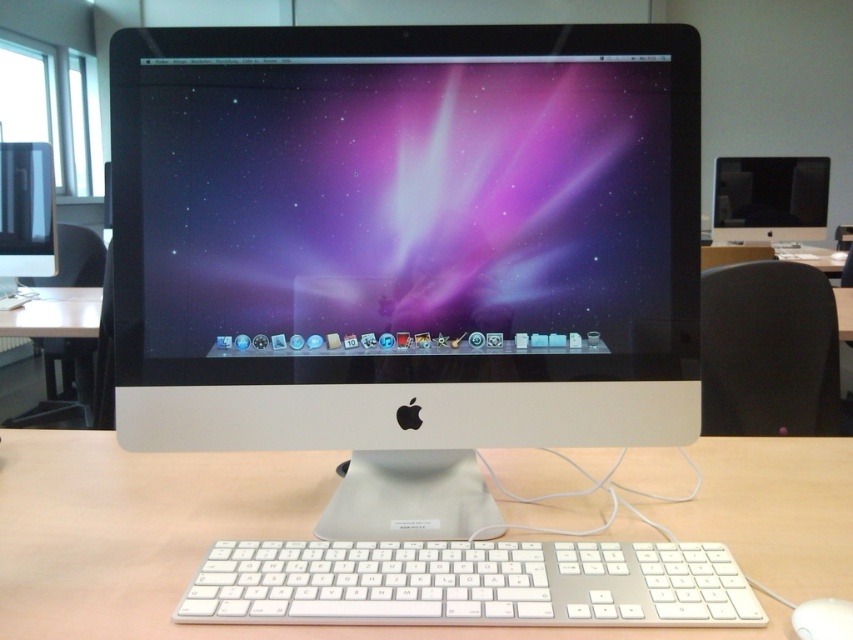
Question: Does white matte computer desk at center have a smaller size compared to white wooden table at lower left?

Choices:
 (A) yes
 (B) no

Answer: (A)

Question: Is black plastic chair at right wider than satin black monitor at upper right?

Choices:
 (A) no
 (B) yes

Answer: (A)

Question: Can you confirm if satin silver monitor at center is wider than matte black monitor at left?

Choices:
 (A) yes
 (B) no

Answer: (A)

Question: Which is nearer to the white matte computer desk at center?

Choices:
 (A) white plastic keyboard at center
 (B) white plastic mouse at lower right
 (C) black plastic chair at right
 (D) matte black monitor at left

Answer: (A)

Question: Among these points, which one is nearest to the camera?

Choices:
 (A) (119, 214)
 (B) (96, 474)
 (C) (811, 310)
 (D) (811, 237)

Answer: (A)

Question: Which of the following is the closest to the observer?

Choices:
 (A) white plastic mouse at lower right
 (B) white matte computer desk at center
 (C) white wooden table at lower left
 (D) matte black monitor at left

Answer: (A)